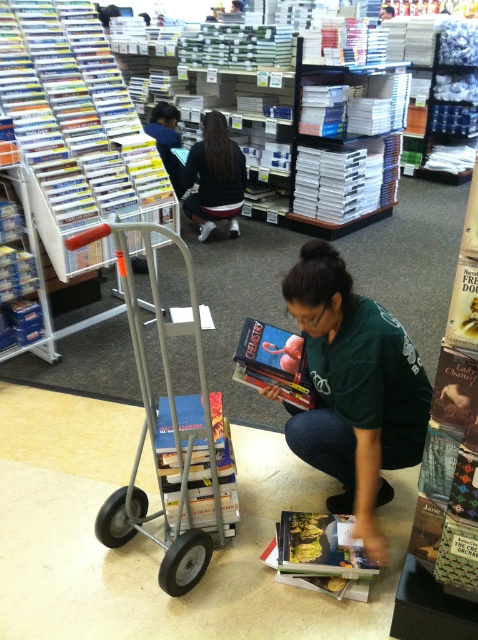
Question: Which point is farther from the camera taking this photo?

Choices:
 (A) (177, 506)
 (B) (50, 150)
 (C) (218, 195)

Answer: (C)

Question: Is hardcover book at lower center in front of dark brown hair at upper center?

Choices:
 (A) no
 (B) yes

Answer: (B)

Question: Which object appears closest to the camera in this image?

Choices:
 (A) hardcover book at lower center
 (B) matte hardcover book at center

Answer: (A)

Question: Where is green matte shirt at center located in relation to hardcover book at lower center in the image?

Choices:
 (A) right
 (B) left

Answer: (A)

Question: Is dark brown hair at upper center smaller than matte hardcover book at center?

Choices:
 (A) yes
 (B) no

Answer: (B)

Question: Which object is the farthest from the white glossy book at upper left?

Choices:
 (A) matte hardcover book at center
 (B) hardcover book at lower center

Answer: (B)